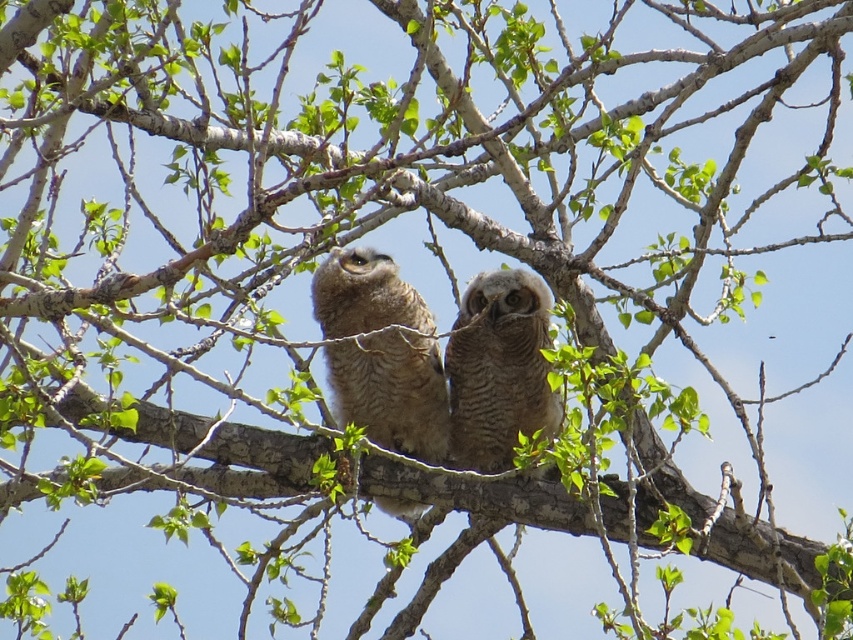
Does brown speckled owl at center appear on the right side of brown textured owl at center?

Incorrect, brown speckled owl at center is not on the right side of brown textured owl at center.

Does point (376, 364) come in front of point (538, 378)?

No, (376, 364) is further to viewer.

This screenshot has height=640, width=853. I want to click on brown speckled owl at center, so click(392, 392).